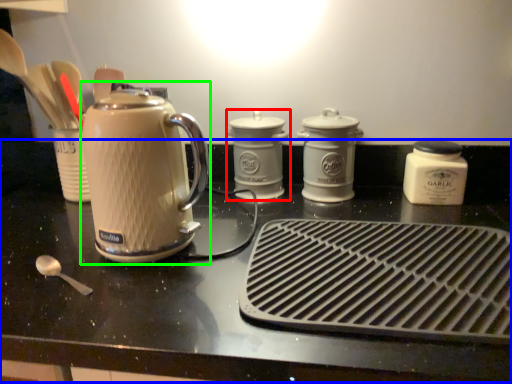
Question: Which object is positioned farthest from kitchen appliance (highlighted by a red box)? Select from table (highlighted by a blue box) and kettle (highlighted by a green box).

Choices:
 (A) table
 (B) kettle

Answer: (B)